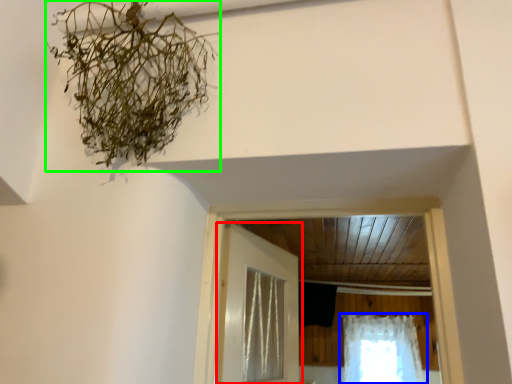
Question: Estimate the real-world distances between objects in this image. Which object is closer to door (highlighted by a red box), curtain (highlighted by a blue box) or plant (highlighted by a green box)?

Choices:
 (A) curtain
 (B) plant

Answer: (B)